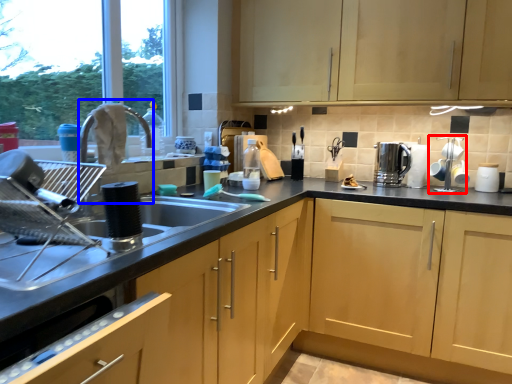
Question: Which of the following is the farthest to the observer, appliance (highlighted by a red box) or faucet (highlighted by a blue box)?

Choices:
 (A) appliance
 (B) faucet

Answer: (A)